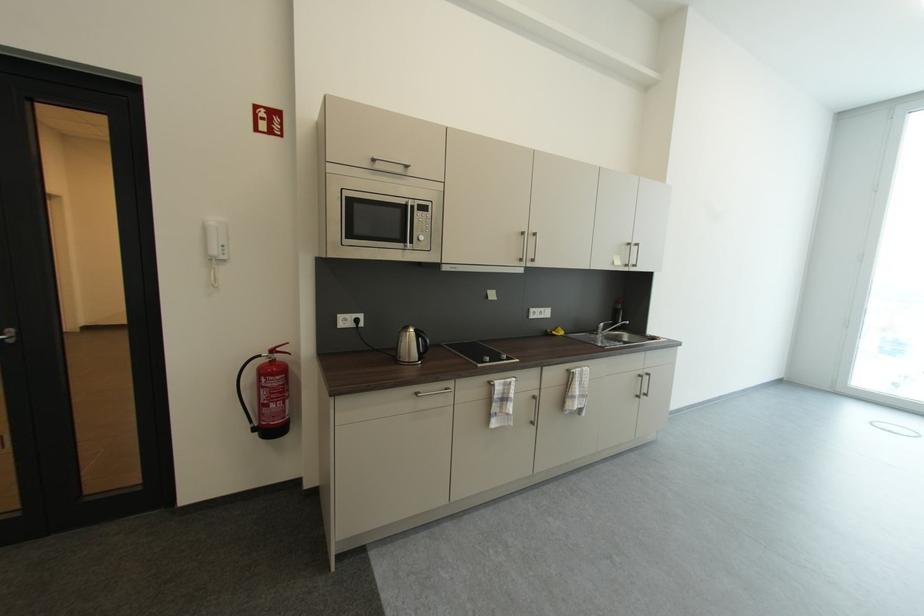
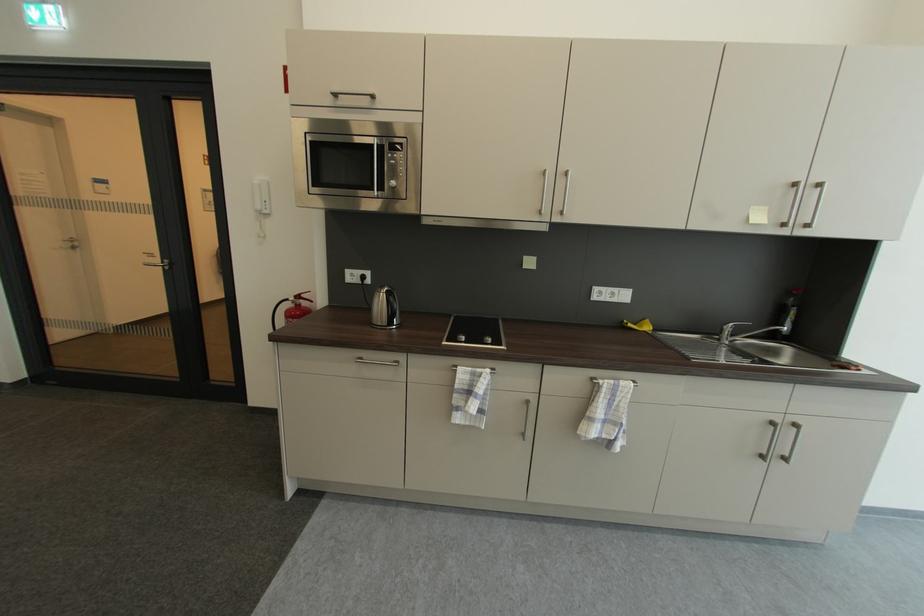
Locate, in the second image, the point that corresponds to point 423,395 in the first image.

(367, 360)